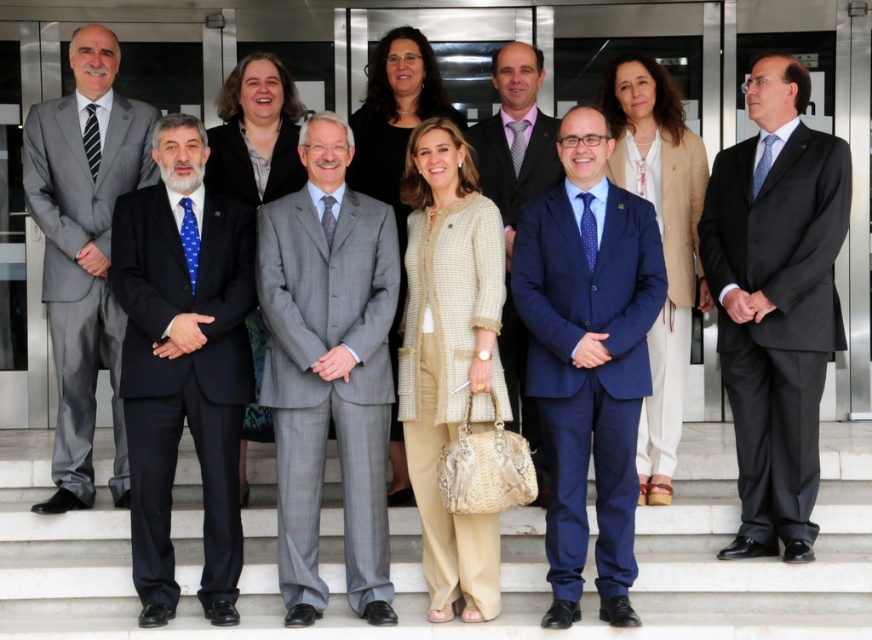
Is gray checkered suit at center to the right of beige textured blazer at center from the viewer's perspective?

Incorrect, gray checkered suit at center is not on the right side of beige textured blazer at center.

Between gray checkered suit at center and beige textured blazer at center, which one has more height?

Standing taller between the two is gray checkered suit at center.

Is point (376, 406) closer to camera compared to point (678, 316)?

Yes, it is.

Identify the location of gray checkered suit at center. The height and width of the screenshot is (640, 872). (329, 369).

Is gray checkered suit at center positioned behind beige tweed coat at center?

Yes, gray checkered suit at center is behind beige tweed coat at center.

Can you confirm if gray checkered suit at center is shorter than beige tweed coat at center?

Incorrect, gray checkered suit at center's height does not fall short of beige tweed coat at center's.

Does point (305, 608) come closer to viewer compared to point (412, 314)?

Yes, point (305, 608) is in front of point (412, 314).

Identify the location of gray checkered suit at center. The height and width of the screenshot is (640, 872). (329, 369).

Does point (763, 262) come behind point (421, 282)?

Yes, point (763, 262) is behind point (421, 282).

Does black silk suit at center have a greater width compared to beige tweed coat at center?

Indeed, black silk suit at center has a greater width compared to beige tweed coat at center.

Where is `black silk suit at center`? This screenshot has width=872, height=640. black silk suit at center is located at coordinates (775, 301).